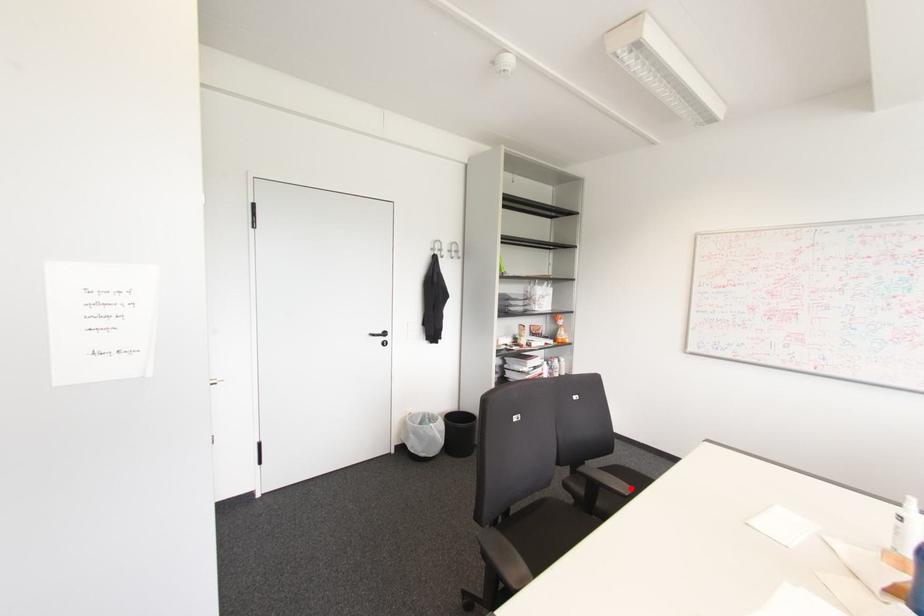
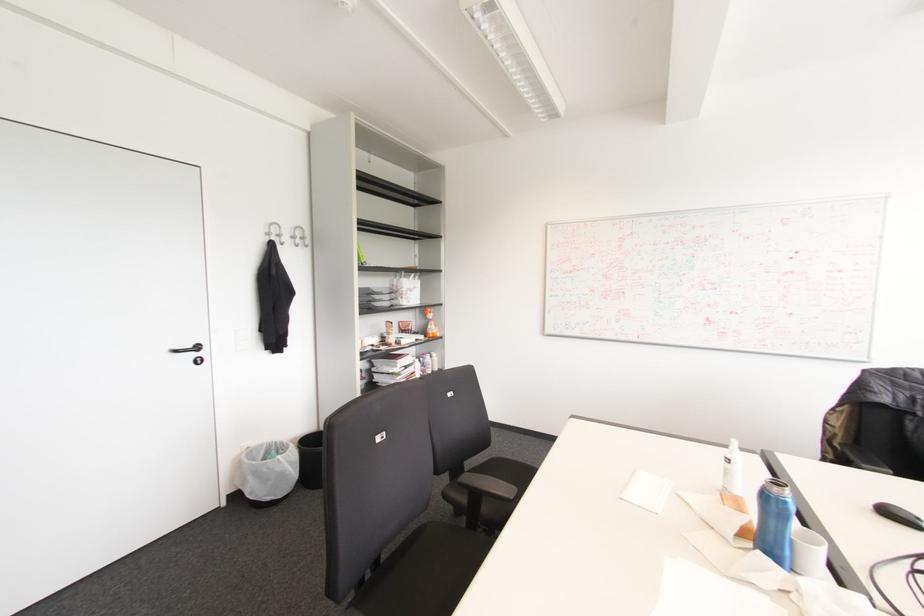
Locate, in the second image, the point that corresponds to the highlighted location in the first image.

(515, 488)